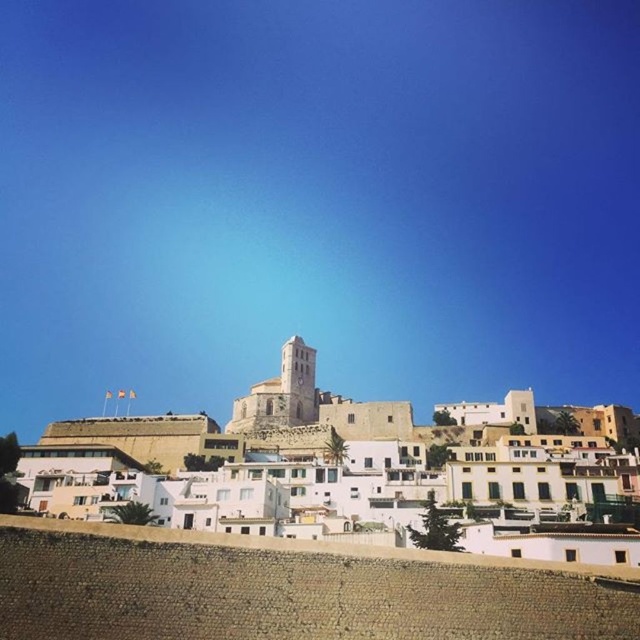
Does brown cobblestone wall at lower center appear under white stucco buildings at center?

Incorrect, brown cobblestone wall at lower center is not positioned below white stucco buildings at center.

Consider the image. Is brown cobblestone wall at lower center bigger than white stucco buildings at center?

No, brown cobblestone wall at lower center is not bigger than white stucco buildings at center.

The width and height of the screenshot is (640, 640). Describe the element at coordinates (284, 595) in the screenshot. I see `brown cobblestone wall at lower center` at that location.

The width and height of the screenshot is (640, 640). I want to click on brown cobblestone wall at lower center, so click(x=284, y=595).

Which is above, white stucco buildings at center or white stone tower at center?

Positioned higher is white stone tower at center.

Identify the location of white stucco buildings at center. (371, 472).

Does brown cobblestone wall at lower center appear on the right side of white stone tower at center?

Correct, you'll find brown cobblestone wall at lower center to the right of white stone tower at center.

Is brown cobblestone wall at lower center closer to the viewer compared to white stone tower at center?

Yes.

Is point (278, 621) more distant than point (316, 413)?

No, (278, 621) is in front of (316, 413).

Where is `brown cobblestone wall at lower center`? Image resolution: width=640 pixels, height=640 pixels. brown cobblestone wall at lower center is located at coordinates click(284, 595).